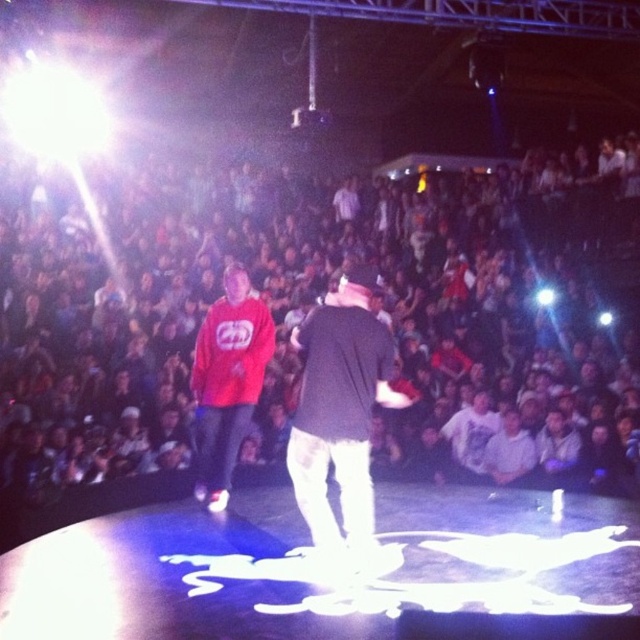
You are a photographer at the event and need to capture a closeup of both the black matte jacket at center and the matte red hoodie at center. Since your camera can only focus on one subject at a time, which jacket should you focus on first to ensure the wider subject is in frame?

The black matte jacket at center is wider than the matte red hoodie at center, so you should focus on the black matte jacket at center first to ensure its wider dimensions are properly captured in the frame.

You are a photographer at the event and want to capture a clear photo of the matte red hoodie at center without the dark clothing audience at center blocking it. Based on their heights, is this possible?

The dark clothing audience at center has a greater height compared to matte red hoodie at center, so it is likely blocking the view. Therefore, it might not be possible to capture a clear photo of the matte red hoodie at center without obstruction.